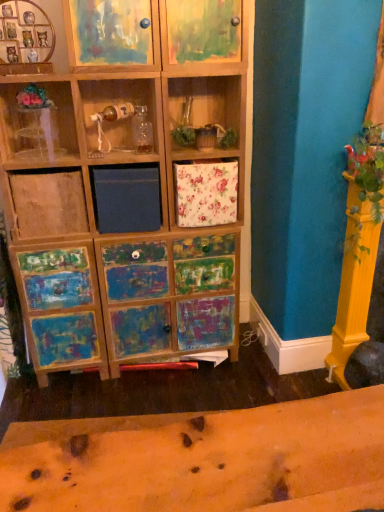
What do you see at coordinates (112, 34) in the screenshot?
I see `painted wood cabinet at upper left, marked as the 2th cabinet in a right-to-left arrangement` at bounding box center [112, 34].

The image size is (384, 512). In order to click on transparent plastic vase at upper left in this screenshot , I will do `click(37, 123)`.

Is painted wood cabinet at upper left, the 1th cabinet viewed from the left, facing away from transparent plastic vase at upper left?

No.

From the image's perspective, which object appears higher, painted wood cabinet at upper left, the 1th cabinet viewed from the left, or transparent plastic vase at upper left?

painted wood cabinet at upper left, the 1th cabinet viewed from the left, appears higher in the image.

Is painted wood cabinet at upper left, marked as the 2th cabinet in a right-to-left arrangement, bigger or smaller than transparent plastic vase at upper left?

painted wood cabinet at upper left, marked as the 2th cabinet in a right-to-left arrangement, is bigger than transparent plastic vase at upper left.

What's the angular difference between painted wood cabinet at upper left, marked as the 2th cabinet in a right-to-left arrangement, and transparent plastic vase at upper left's facing directions?

2.36 degrees.

From the image's perspective, does painted wood cabinet at upper center, the 2th cabinet positioned from the left, appear higher than painted wood cabinet at upper left, the 1th cabinet viewed from the left?

Correct, painted wood cabinet at upper center, the 2th cabinet positioned from the left, appears higher than painted wood cabinet at upper left, the 1th cabinet viewed from the left, in the image.

Are painted wood cabinet at upper center, the 2th cabinet positioned from the left, and painted wood cabinet at upper left, the 1th cabinet viewed from the left, making contact?

There is a gap between painted wood cabinet at upper center, the 2th cabinet positioned from the left, and painted wood cabinet at upper left, the 1th cabinet viewed from the left.

From a real-world perspective, is painted wood cabinet at upper center, the 2th cabinet positioned from the left, over painted wood cabinet at upper left, the 1th cabinet viewed from the left?

No.

Can you confirm if painted wood cabinet at upper center, the first cabinet from the right, is shorter than painted wood cabinet at upper left, the 1th cabinet viewed from the left?

Yes, painted wood cabinet at upper center, the first cabinet from the right, is shorter than painted wood cabinet at upper left, the 1th cabinet viewed from the left.

Based on the photo, can you confirm if painted wood cabinet at upper left, the 1th cabinet viewed from the left, is bigger than painted wood cabinet at upper center, the 2th cabinet positioned from the left?

No.

From the image's perspective, which object appears higher, painted wood cabinet at upper left, marked as the 2th cabinet in a right-to-left arrangement, or painted wood cabinet at upper center, the 2th cabinet positioned from the left?

painted wood cabinet at upper center, the 2th cabinet positioned from the left, from the image's perspective.

Which is in front, point (156, 50) or point (181, 22)?

The point (181, 22) is closer.

Considering the relative sizes of painted wood cabinet at upper left, marked as the 2th cabinet in a right-to-left arrangement, and painted wood cabinet at upper center, the 2th cabinet positioned from the left, in the image provided, is painted wood cabinet at upper left, marked as the 2th cabinet in a right-to-left arrangement, thinner than painted wood cabinet at upper center, the 2th cabinet positioned from the left,?

Yes, painted wood cabinet at upper left, marked as the 2th cabinet in a right-to-left arrangement, is thinner than painted wood cabinet at upper center, the 2th cabinet positioned from the left.

Does transparent plastic vase at upper left appear on the right side of painted wood cabinet at upper left, marked as the 2th cabinet in a right-to-left arrangement?

Incorrect, transparent plastic vase at upper left is not on the right side of painted wood cabinet at upper left, marked as the 2th cabinet in a right-to-left arrangement.

Would you consider transparent plastic vase at upper left to be distant from painted wood cabinet at upper left, the 1th cabinet viewed from the left?

No, there isn't a large distance between transparent plastic vase at upper left and painted wood cabinet at upper left, the 1th cabinet viewed from the left.

Is transparent plastic vase at upper left oriented away from painted wood cabinet at upper left, marked as the 2th cabinet in a right-to-left arrangement?

No, painted wood cabinet at upper left, marked as the 2th cabinet in a right-to-left arrangement, is not at the back of transparent plastic vase at upper left.

Which of these two, transparent plastic vase at upper left or painted wood cabinet at upper left, the 1th cabinet viewed from the left, is thinner?

Thinner between the two is transparent plastic vase at upper left.

From a real-world perspective, which object rests below the other?

transparent plastic vase at upper left, from a real-world perspective.

From the image's perspective, which is below, transparent plastic vase at upper left or painted wood cabinet at upper center, the 2th cabinet positioned from the left?

transparent plastic vase at upper left.

Consider the image. Is transparent plastic vase at upper left at the right side of painted wood cabinet at upper center, the 2th cabinet positioned from the left?

Incorrect, transparent plastic vase at upper left is not on the right side of painted wood cabinet at upper center, the 2th cabinet positioned from the left.

Is transparent plastic vase at upper left situated inside painted wood cabinet at upper center, the first cabinet from the right, or outside?

transparent plastic vase at upper left is not enclosed by painted wood cabinet at upper center, the first cabinet from the right.

Between painted wood cabinet at upper center, the 2th cabinet positioned from the left, and transparent plastic vase at upper left, which one has more height?

painted wood cabinet at upper center, the 2th cabinet positioned from the left.

Based on the photo, from a real-world perspective, who is located lower, painted wood cabinet at upper center, the first cabinet from the right, or transparent plastic vase at upper left?

In real-world perspective, transparent plastic vase at upper left is lower.

In the scene shown: Considering the relative positions of painted wood cabinet at upper center, the first cabinet from the right, and transparent plastic vase at upper left in the image provided, is painted wood cabinet at upper center, the first cabinet from the right, to the left or to the right of transparent plastic vase at upper left?

From the image, it's evident that painted wood cabinet at upper center, the first cabinet from the right, is to the right of transparent plastic vase at upper left.

Which cabinet is the 2nd one when counting from the front of the transparent plastic vase at upper left? Please provide its 2D coordinates.

[(112, 34)]

Locate an element on the screen. The image size is (384, 512). cabinet on the right of painted wood cabinet at upper left, marked as the 2th cabinet in a right-to-left arrangement is located at coordinates pos(203,30).

Looking at the image, which one is located further to transparent plastic vase at upper left, painted wood cabinet at upper left, the 1th cabinet viewed from the left, or painted wood cabinet at upper center, the first cabinet from the right?

painted wood cabinet at upper center, the first cabinet from the right, is positioned further to the anchor transparent plastic vase at upper left.

Estimate the real-world distances between objects in this image. Which object is further from painted wood cabinet at upper center, the first cabinet from the right, painted wood cabinet at upper left, the 1th cabinet viewed from the left, or transparent plastic vase at upper left?

Among the two, transparent plastic vase at upper left is located further to painted wood cabinet at upper center, the first cabinet from the right.

Estimate the real-world distances between objects in this image. Which object is closer to painted wood cabinet at upper left, marked as the 2th cabinet in a right-to-left arrangement, painted wood cabinet at upper center, the 2th cabinet positioned from the left, or transparent plastic vase at upper left?

Based on the image, painted wood cabinet at upper center, the 2th cabinet positioned from the left, appears to be nearer to painted wood cabinet at upper left, marked as the 2th cabinet in a right-to-left arrangement.

Looking at this image, considering their positions, is painted wood cabinet at upper center, the first cabinet from the right, positioned further to transparent plastic vase at upper left than painted wood cabinet at upper left, the 1th cabinet viewed from the left?

painted wood cabinet at upper center, the first cabinet from the right, lies further to transparent plastic vase at upper left than the other object.

Estimate the real-world distances between objects in this image. Which object is further from painted wood cabinet at upper center, the 2th cabinet positioned from the left, transparent plastic vase at upper left or painted wood cabinet at upper left, marked as the 2th cabinet in a right-to-left arrangement?

The object further to painted wood cabinet at upper center, the 2th cabinet positioned from the left, is transparent plastic vase at upper left.

Estimate the real-world distances between objects in this image. Which object is further from painted wood cabinet at upper left, marked as the 2th cabinet in a right-to-left arrangement, transparent plastic vase at upper left or painted wood cabinet at upper center, the first cabinet from the right?

transparent plastic vase at upper left is further to painted wood cabinet at upper left, marked as the 2th cabinet in a right-to-left arrangement.

Find the location of a particular element. This screenshot has height=512, width=384. cabinet between transparent plastic vase at upper left and painted wood cabinet at upper center, the 2th cabinet positioned from the left, in the horizontal direction is located at coordinates (112, 34).